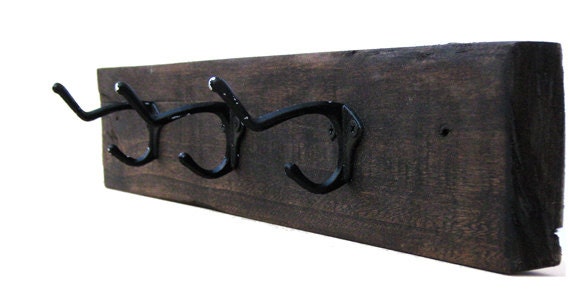
Where is `far right hanger`? far right hanger is located at coordinates (222, 91).